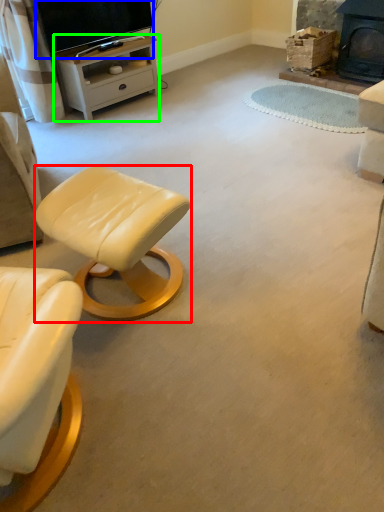
Question: Which object is positioned closest to stool (highlighted by a red box)? Select from television (highlighted by a blue box) and desk (highlighted by a green box).

Choices:
 (A) television
 (B) desk

Answer: (B)